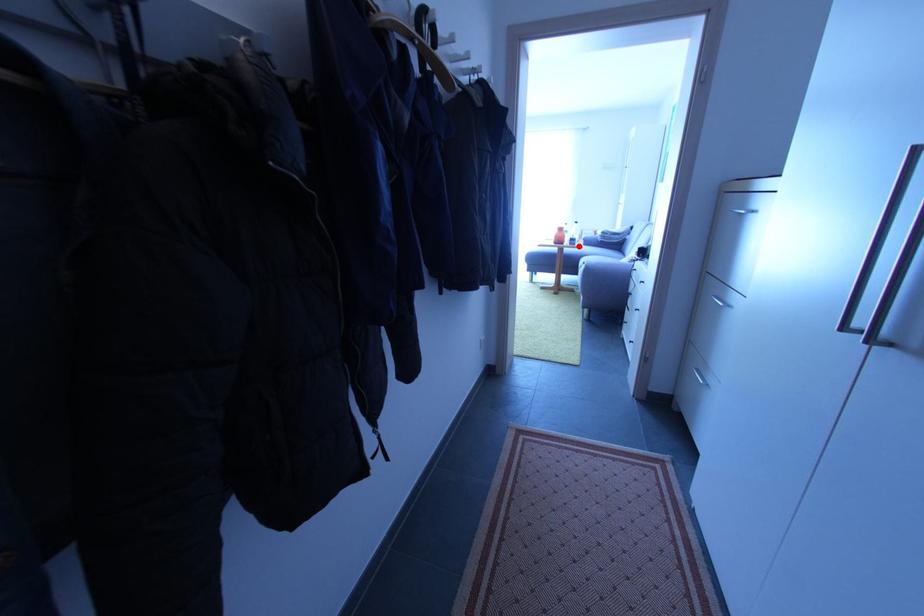
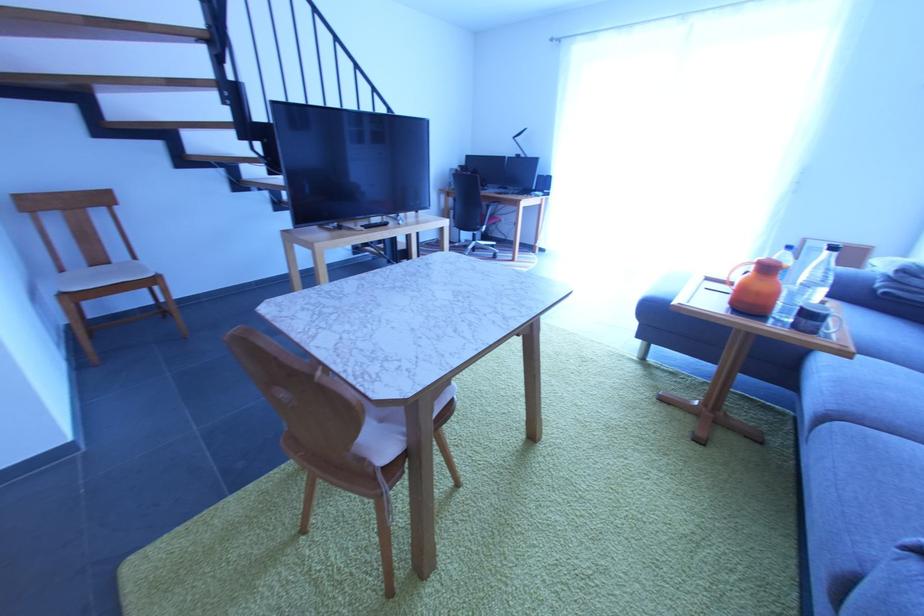
Question: I am providing you with two images of the same scene from different viewpoints. Image1 has a red point marked. In image2, the corresponding 3D location appears at what relative position? Reply with the corresponding letter.

Choices:
 (A) Closer
 (B) Farther

Answer: (B)